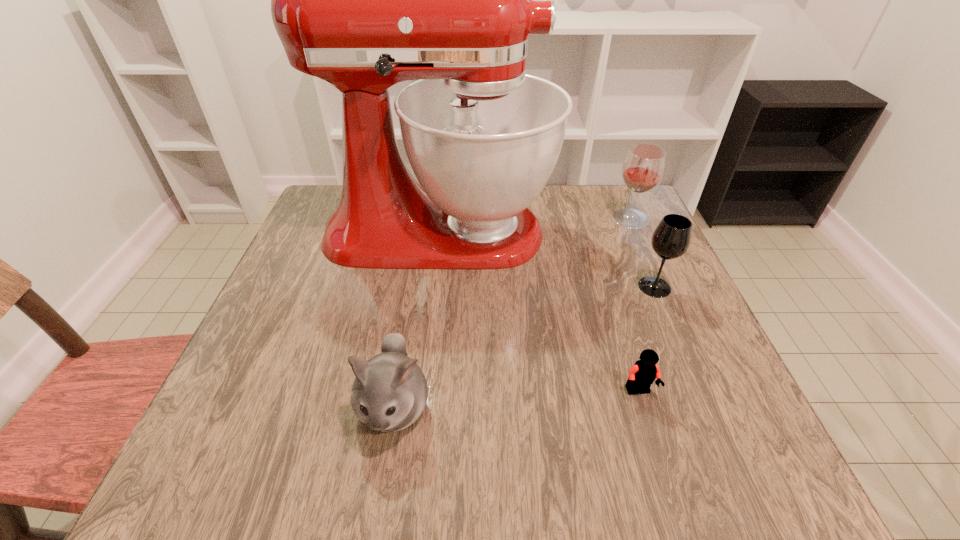
You are a GUI agent. You are given a task and a screenshot of the screen. Output one action in this format:
    pyautogui.click(x=<x>, y=<y>)
    Task: Click on the free space at the right edge
    This screenshot has width=960, height=540.
    Given the screenshot: What is the action you would take?
    pyautogui.click(x=681, y=410)

Locate an element on the screen. vacant space at the near left corner of the desktop is located at coordinates (205, 443).

Locate an element on the screen. vacant region at the near right corner of the desktop is located at coordinates (x=684, y=457).

Identify the location of vacant space in between the Lego and the nearer wineglass. (647, 339).

Locate an element on the screen. This screenshot has height=540, width=960. free space between the farther wineglass and the Lego is located at coordinates (635, 305).

Where is `vacant area that lies between the nearer wineglass and the farther wineglass`? vacant area that lies between the nearer wineglass and the farther wineglass is located at coordinates (642, 253).

Where is `unoccupied area between the tallest object and the second shortest object`? unoccupied area between the tallest object and the second shortest object is located at coordinates (417, 320).

Locate an element on the screen. This screenshot has height=540, width=960. free spot between the farther wineglass and the nearer wineglass is located at coordinates (642, 253).

At what (x,y) coordinates should I click in order to perform the action: click on free space between the nearer wineglass and the fourth tallest object. Please return your answer as a coordinate pair (x, y). Looking at the image, I should click on (524, 347).

The height and width of the screenshot is (540, 960). Find the location of `empty location between the hamster and the mixer`. empty location between the hamster and the mixer is located at coordinates (417, 320).